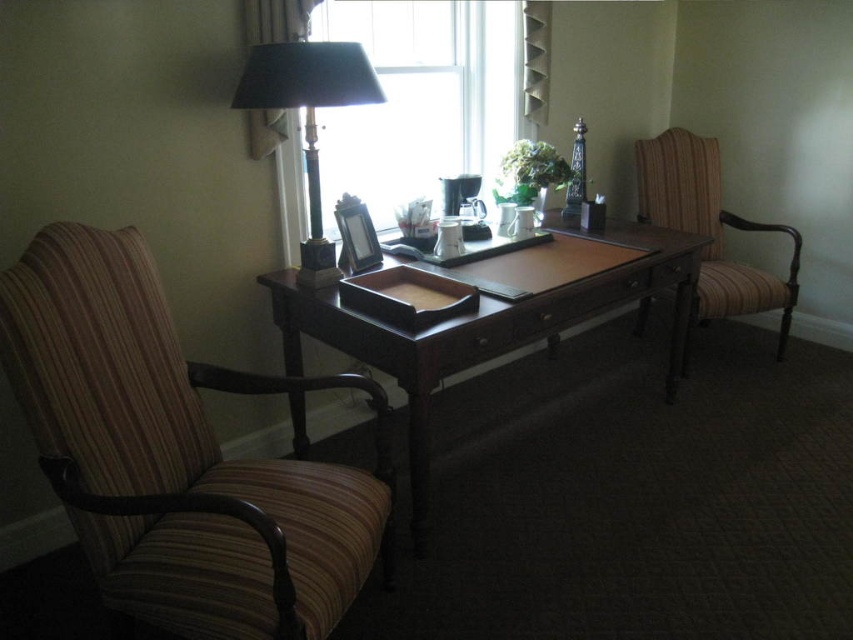
In the scene shown: Does dark wood desk at center have a lesser height compared to striped fabric armchair at right?

No, dark wood desk at center is not shorter than striped fabric armchair at right.

Does dark wood desk at center have a greater width compared to striped fabric armchair at right?

Yes, dark wood desk at center is wider than striped fabric armchair at right.

Is point (648, 256) more distant than point (701, 228)?

No.

At what (x,y) coordinates should I click in order to perform the action: click on dark wood desk at center. Please return your answer as a coordinate pair (x, y). Looking at the image, I should click on (489, 326).

Is striped fabric swivel chair at left closer to camera compared to striped fabric armchair at right?

Yes, it is.

Is point (94, 333) positioned after point (711, 218)?

No, it is in front of (711, 218).

Where is `striped fabric swivel chair at left`? The width and height of the screenshot is (853, 640). striped fabric swivel chair at left is located at coordinates (177, 456).

Who is positioned more to the left, striped fabric armchair at right or black marble lamp at upper left?

black marble lamp at upper left

Can you confirm if striped fabric armchair at right is shorter than black marble lamp at upper left?

In fact, striped fabric armchair at right may be taller than black marble lamp at upper left.

Is point (700, 147) positioned after point (241, 92)?

Yes, point (700, 147) is farther from viewer.

Identify the location of striped fabric armchair at right. The image size is (853, 640). (711, 228).